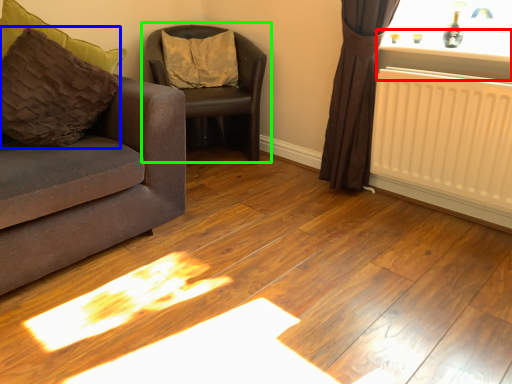
Question: Based on their relative distances, which object is nearer to window sill (highlighted by a red box)? Choose from pillow (highlighted by a blue box) and chair (highlighted by a green box).

Choices:
 (A) pillow
 (B) chair

Answer: (B)